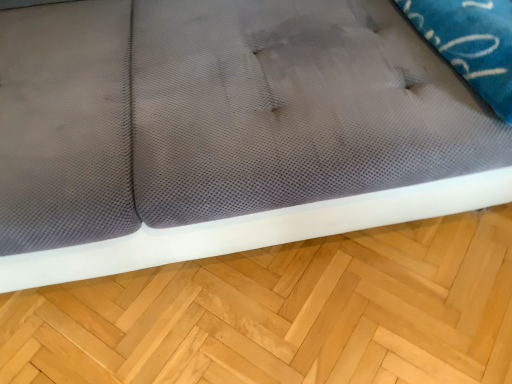
Question: Considering the relative sizes of white mesh pillow at upper right and light brown wood at lower center in the image provided, is white mesh pillow at upper right taller than light brown wood at lower center?

Choices:
 (A) no
 (B) yes

Answer: (B)

Question: Is white mesh pillow at upper right shorter than light brown wood at lower center?

Choices:
 (A) no
 (B) yes

Answer: (A)

Question: Is light brown wood at lower center surrounded by white mesh pillow at upper right?

Choices:
 (A) no
 (B) yes

Answer: (A)

Question: Is white mesh pillow at upper right oriented away from light brown wood at lower center?

Choices:
 (A) no
 (B) yes

Answer: (A)

Question: Considering the relative sizes of white mesh pillow at upper right and light brown wood at lower center in the image provided, is white mesh pillow at upper right bigger than light brown wood at lower center?

Choices:
 (A) yes
 (B) no

Answer: (B)

Question: Considering the relative positions of white mesh pillow at upper right and light brown wood at lower center in the image provided, is white mesh pillow at upper right to the right of light brown wood at lower center from the viewer's perspective?

Choices:
 (A) no
 (B) yes

Answer: (B)

Question: Does light brown wood at lower center have a smaller size compared to white mesh pillow at upper right?

Choices:
 (A) yes
 (B) no

Answer: (B)

Question: From a real-world perspective, is light brown wood at lower center under white mesh pillow at upper right?

Choices:
 (A) no
 (B) yes

Answer: (B)

Question: Is light brown wood at lower center positioned with its back to white mesh pillow at upper right?

Choices:
 (A) yes
 (B) no

Answer: (B)

Question: Considering the relative sizes of light brown wood at lower center and white mesh pillow at upper right in the image provided, is light brown wood at lower center wider than white mesh pillow at upper right?

Choices:
 (A) no
 (B) yes

Answer: (A)

Question: Is light brown wood at lower center thinner than white mesh pillow at upper right?

Choices:
 (A) no
 (B) yes

Answer: (B)

Question: Is light brown wood at lower center at the left side of white mesh pillow at upper right?

Choices:
 (A) yes
 (B) no

Answer: (A)

Question: Is white mesh pillow at upper right bigger or smaller than light brown wood at lower center?

Choices:
 (A) big
 (B) small

Answer: (B)